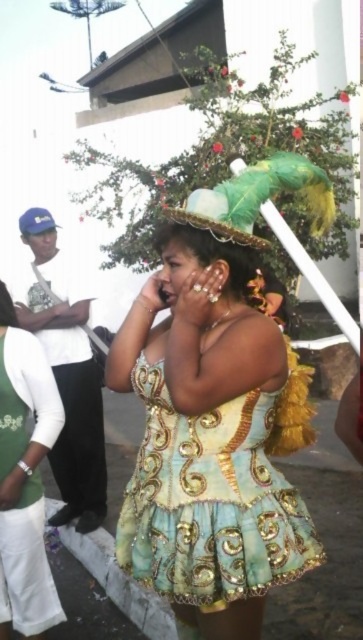
Does point (270, 566) come farther from viewer compared to point (25, 406)?

No, (270, 566) is closer to viewer.

Which of these two, shiny gold dress at center or green satin dress at center, stands taller?

green satin dress at center

Between point (283, 552) and point (22, 337), which one is positioned in front?

Point (283, 552) is more forward.

The width and height of the screenshot is (363, 640). In order to click on shiny gold dress at center in this screenshot , I will do coord(211,432).

Does shiny gold dress at center have a lesser width compared to green feathered hat at upper center?

Correct, shiny gold dress at center's width is less than green feathered hat at upper center's.

Does point (116, 528) come behind point (316, 179)?

Yes.

The image size is (363, 640). I want to click on shiny gold dress at center, so click(x=211, y=432).

Does point (26, 499) lie in front of point (279, 173)?

No, it is behind (279, 173).

Is point (54, 611) behind point (287, 179)?

Yes, it is.

Measure the distance between point [3,429] and camera.

Point [3,429] is 7.38 feet from camera.

Locate an element on the screen. The height and width of the screenshot is (640, 363). green satin dress at center is located at coordinates (25, 477).